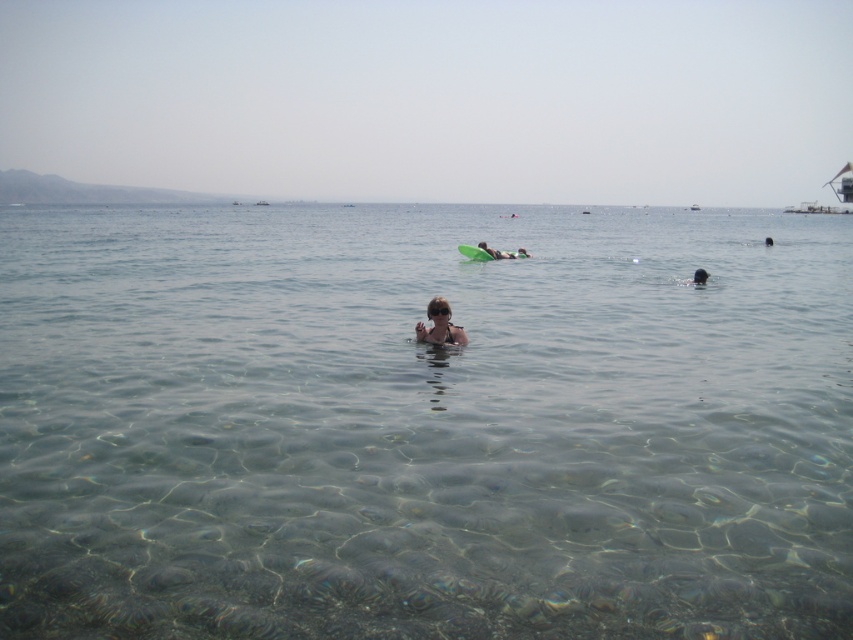
You are a photographer on the beach and want to capture a photo of the clear water at center and dark skin at center. Based on their positions, which object is located to the left in the image?

The clear water at center is to the left of dark skin at center.

You are a photographer trying to capture the clear water at center and dark skin at center in the same frame. Which object will appear bigger in the photo?

The clear water at center will appear bigger in the photo because it is larger in size than the dark skin at center.

You are a photographer trying to capture the beach scene. You notice two points of interest marked as point (451, 332) and point (692, 280). Which point is closer to your camera position?

Point (451, 332) is closer to the viewer than point (692, 280).